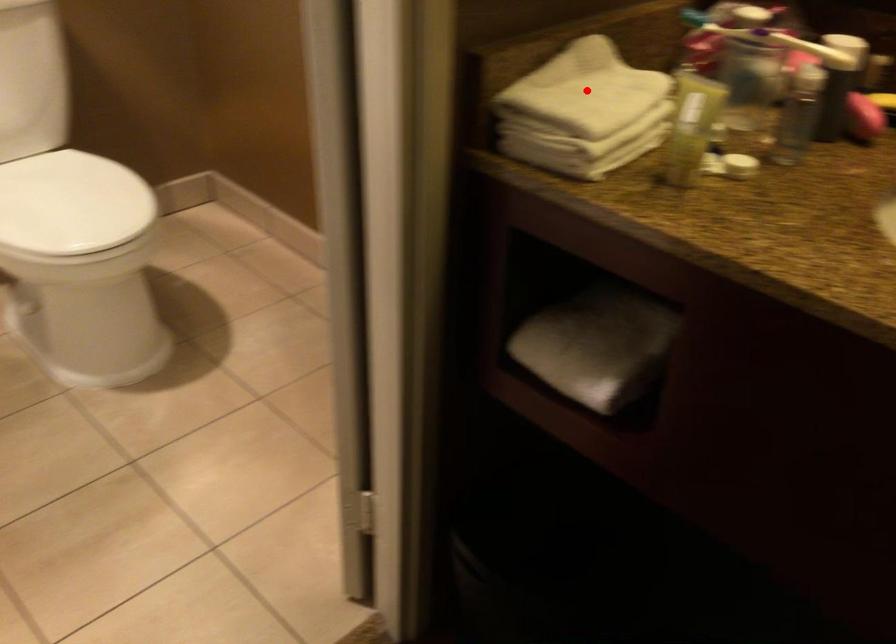
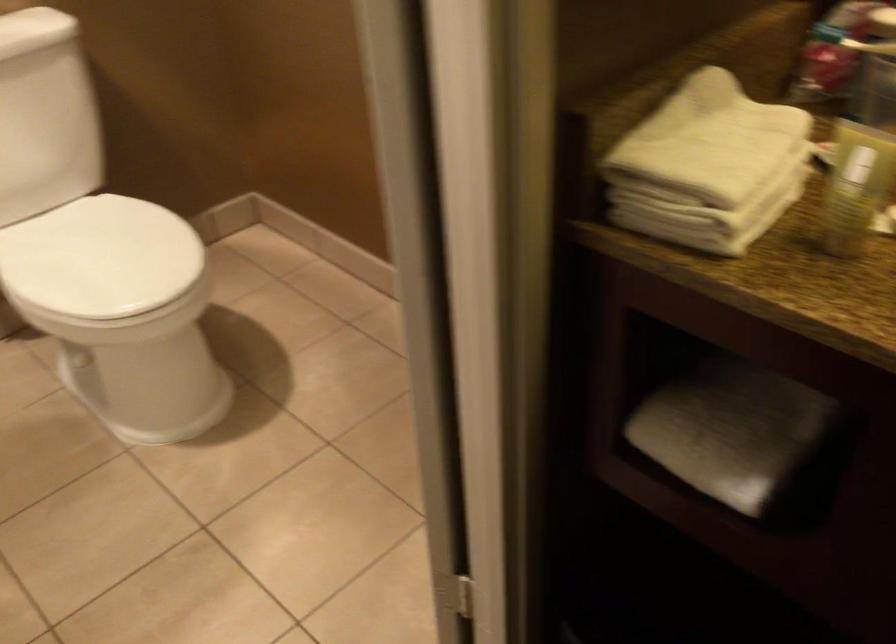
Find the pixel in the second image that matches the highlighted location in the first image.

(711, 140)